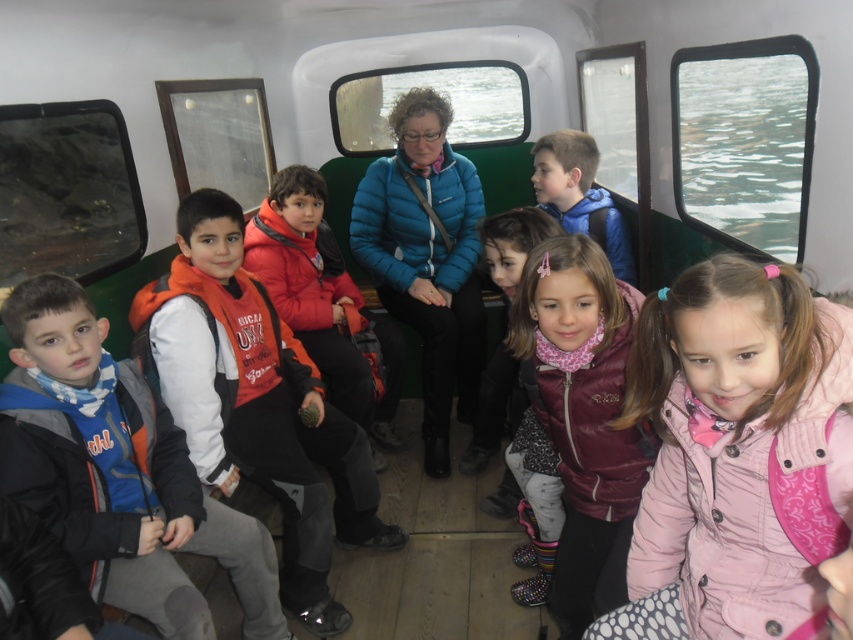
Question: Which point appears closest to the camera in this image?

Choices:
 (A) (560, 356)
 (B) (90, 506)
 (C) (265, 204)

Answer: (A)

Question: Does pink quilted jacket at lower right appear under pink fleece vest at center?

Choices:
 (A) no
 (B) yes

Answer: (A)

Question: Is red puffer jacket at center below blue matte jacket at center?

Choices:
 (A) no
 (B) yes

Answer: (B)

Question: Which point appears closest to the camera in this image?

Choices:
 (A) (10, 401)
 (B) (590, 468)
 (C) (323, 188)
 (D) (505, 291)

Answer: (A)

Question: Which point appears closest to the camera in this image?

Choices:
 (A) (236, 445)
 (B) (757, 547)

Answer: (B)

Question: In this image, where is orange fleece jacket at center located relative to blue matte jacket at center?

Choices:
 (A) above
 (B) below

Answer: (B)